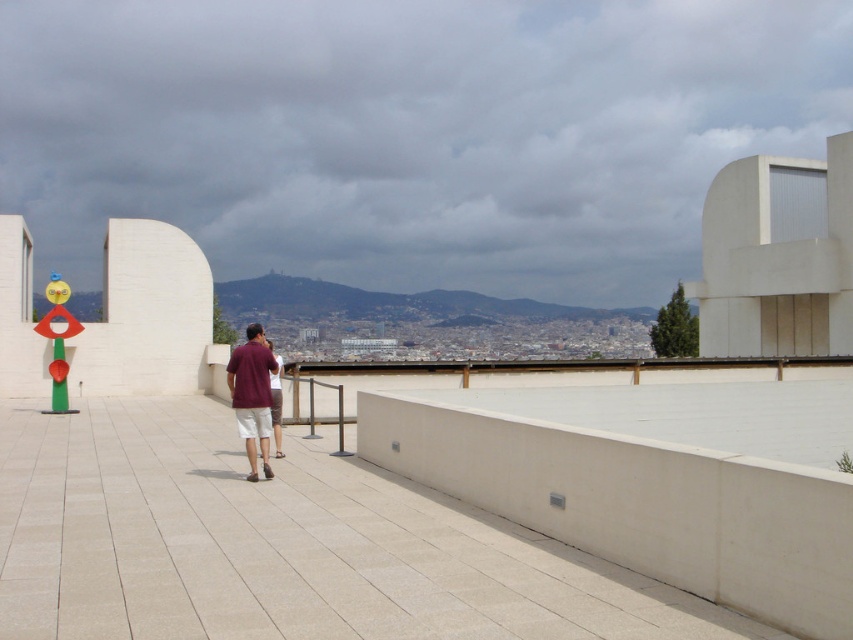
Question: Which is farther from the matte maroon shirt at center?

Choices:
 (A) maroon fabric shirt at center
 (B) white tile pavement at center

Answer: (B)

Question: In this image, where is white tile pavement at center located relative to maroon fabric shirt at center?

Choices:
 (A) below
 (B) above

Answer: (A)

Question: Considering the relative positions of white tile pavement at center and matte maroon shirt at center in the image provided, where is white tile pavement at center located with respect to matte maroon shirt at center?

Choices:
 (A) left
 (B) right

Answer: (B)

Question: Which object appears farthest from the camera in this image?

Choices:
 (A) matte maroon shirt at center
 (B) maroon fabric shirt at center

Answer: (B)

Question: Which object is positioned closest to the white tile pavement at center?

Choices:
 (A) maroon fabric shirt at center
 (B) matte maroon shirt at center

Answer: (B)

Question: Does white tile pavement at center appear on the left side of matte maroon shirt at center?

Choices:
 (A) yes
 (B) no

Answer: (B)